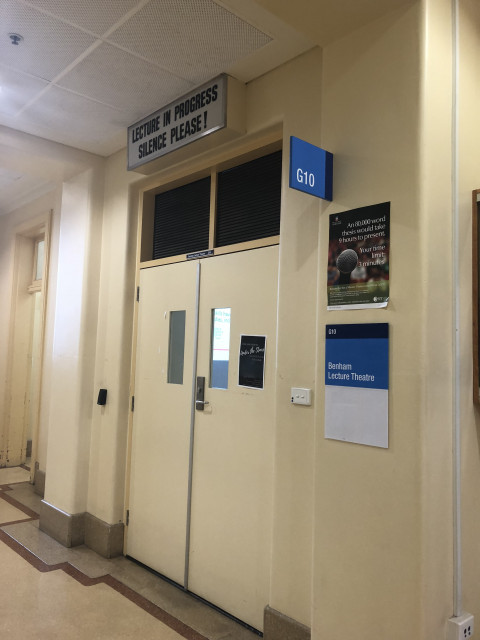
The width and height of the screenshot is (480, 640). Find the location of `floor`. floor is located at coordinates (180, 612), (104, 569), (14, 492), (16, 625).